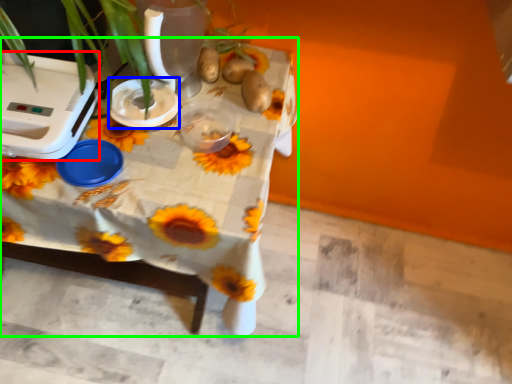
Question: Considering the real-world distances, which object is farthest from appliance (highlighted by a red box)? appliance (highlighted by a blue box) or table (highlighted by a green box)?

Choices:
 (A) appliance
 (B) table

Answer: (B)